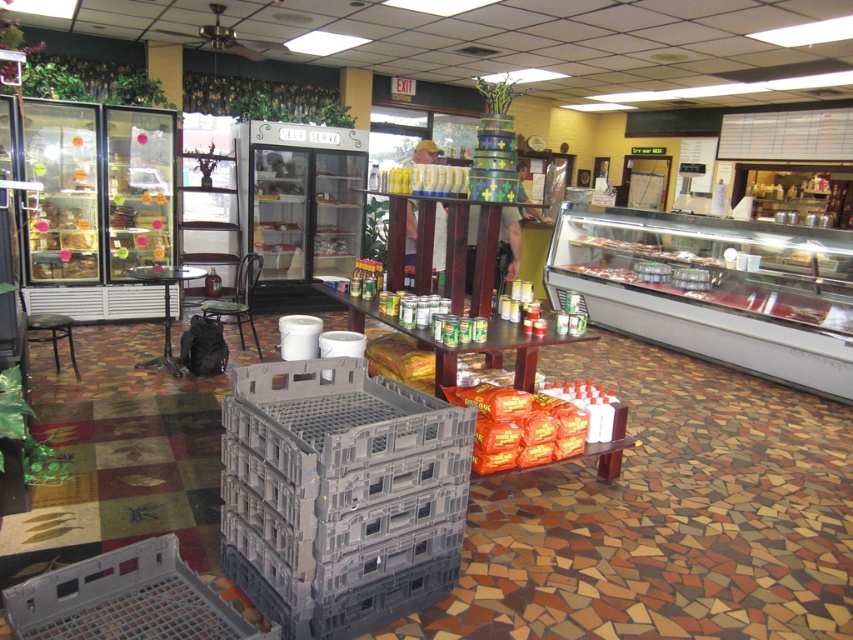
Question: Does gray plastic crate at center have a lesser width compared to black plastic stool at lower left?

Choices:
 (A) yes
 (B) no

Answer: (A)

Question: Can you confirm if gray plastic crate at center is smaller than black plastic stool at lower left?

Choices:
 (A) yes
 (B) no

Answer: (B)

Question: Is gray plastic crate at center closer to camera compared to black plastic stool at lower left?

Choices:
 (A) yes
 (B) no

Answer: (A)

Question: Which point is closer to the camera?

Choices:
 (A) (70, 337)
 (B) (358, 614)

Answer: (B)

Question: Which of the following is the farthest from the observer?

Choices:
 (A) gray plastic crate at center
 (B) black plastic stool at lower left

Answer: (B)

Question: Which object is farther from the camera taking this photo?

Choices:
 (A) black plastic stool at lower left
 (B) gray plastic crate at center

Answer: (A)